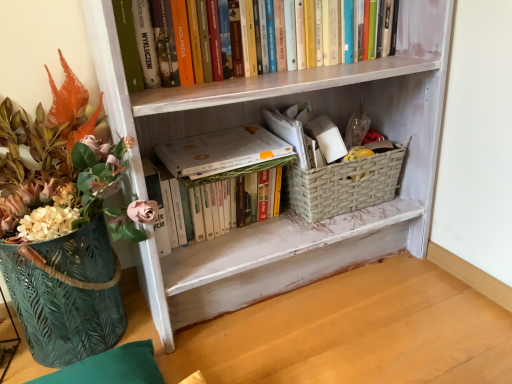
Find the location of `free space above white matte book at center (from a real-world perspective)`. free space above white matte book at center (from a real-world perspective) is located at coordinates (217, 140).